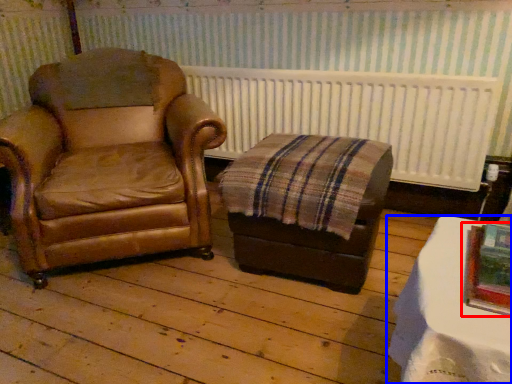
Question: Which of the following is the farthest to the observer, picture frame (highlighted by a red box) or table (highlighted by a blue box)?

Choices:
 (A) picture frame
 (B) table

Answer: (A)